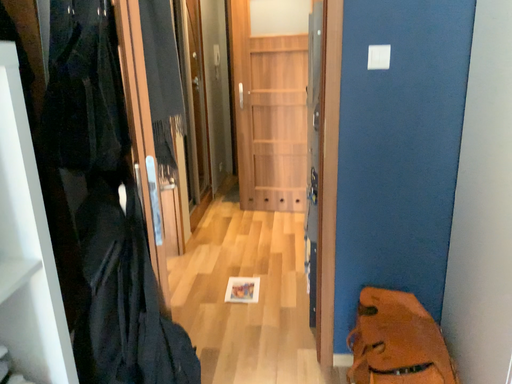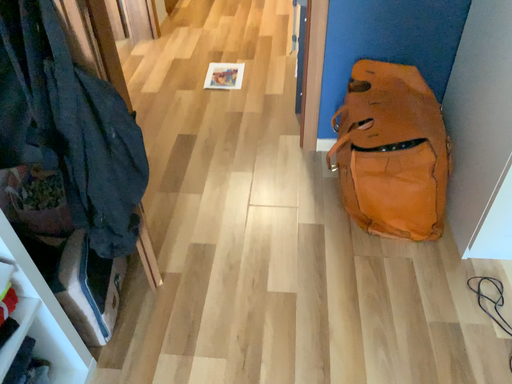
Question: Which way did the camera rotate in the video?

Choices:
 (A) rotated downward
 (B) rotated upward

Answer: (A)